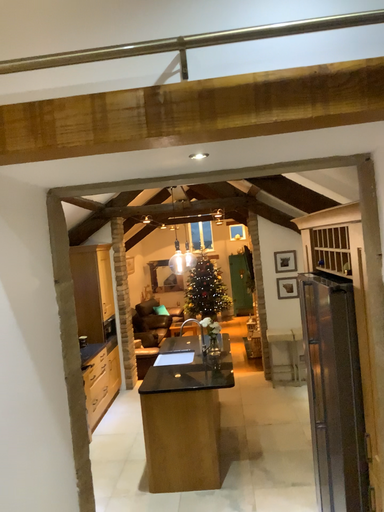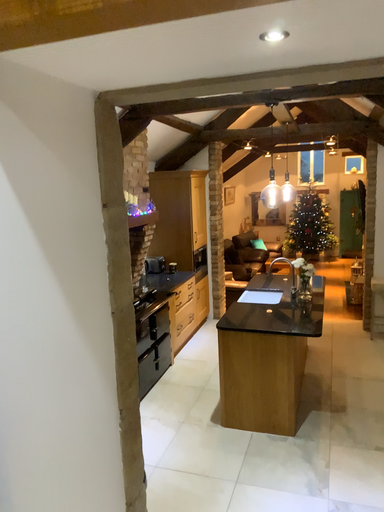
Question: Which way did the camera rotate in the video?

Choices:
 (A) rotated upward
 (B) rotated downward

Answer: (B)